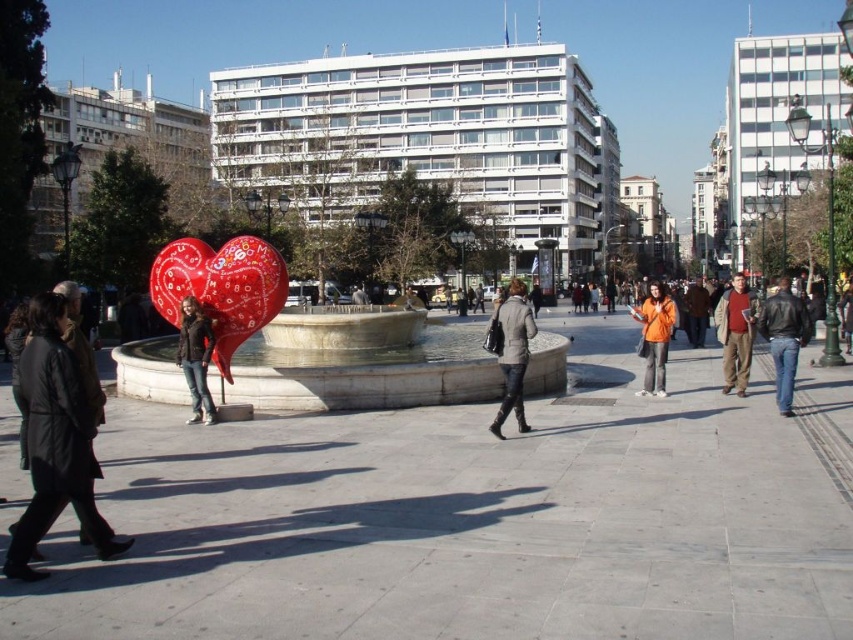
Question: Can you confirm if dark gray coat at left is positioned to the left of orange fleece jacket at center?

Choices:
 (A) yes
 (B) no

Answer: (A)

Question: Among these points, which one is farthest from the camera?

Choices:
 (A) (192, 404)
 (B) (780, 348)
 (C) (654, 284)
 (D) (236, 326)

Answer: (C)

Question: Estimate the real-world distances between objects in this image. Which object is closer to the shiny metallic heart at center?

Choices:
 (A) gray wool coat at center
 (B) leather jacket at right
 (C) orange fleece jacket at center
 (D) orange fuzzy coat at center

Answer: (A)

Question: Which of these objects is positioned closest to the white marble fountain at center?

Choices:
 (A) brown leather jacket at right
 (B) dark brown leather jacket at center

Answer: (B)

Question: Is dark brown leather jacket at center smaller than orange fuzzy coat at center?

Choices:
 (A) no
 (B) yes

Answer: (B)

Question: Can you confirm if dark gray coat at left is wider than shiny metallic heart at center?

Choices:
 (A) no
 (B) yes

Answer: (B)